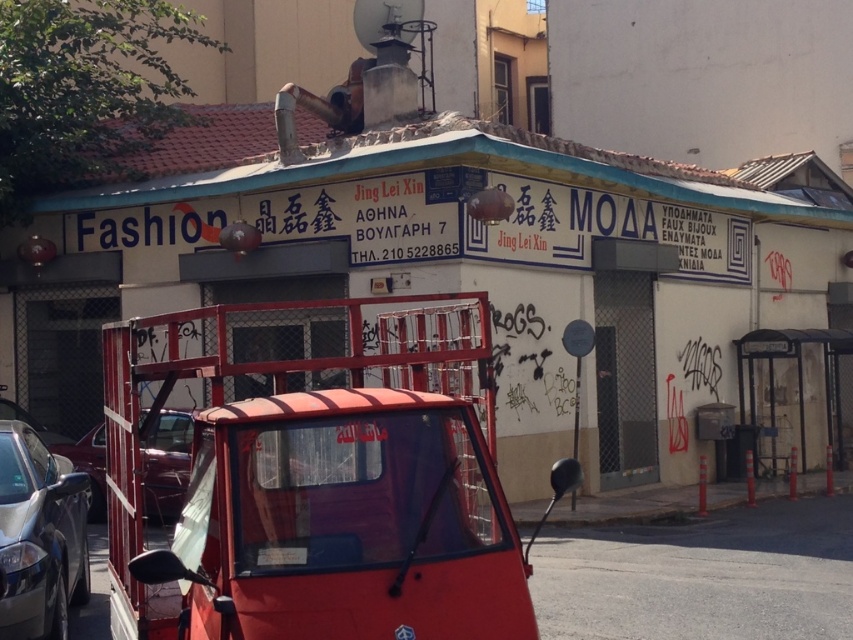
Is silver metallic car at lower left smaller than metallic red car at left?

No.

Which of these two, silver metallic car at lower left or metallic red car at left, stands taller?

silver metallic car at lower left is taller.

Which is behind, point (77, 490) or point (155, 436)?

The point (155, 436) is more distant.

At what (x,y) coordinates should I click in order to perform the action: click on silver metallic car at lower left. Please return your answer as a coordinate pair (x, y). This screenshot has height=640, width=853. Looking at the image, I should click on (39, 536).

Which is above, metallic red car at left or metallic red car at lower left?

metallic red car at lower left is higher up.

Is point (165, 483) positioned behind point (41, 429)?

No.

The height and width of the screenshot is (640, 853). In order to click on metallic red car at left in this screenshot , I will do `click(166, 464)`.

Which is more to the left, silver metallic car at lower left or white plastic license plate at center?

Positioned to the left is silver metallic car at lower left.

Does silver metallic car at lower left appear under white plastic license plate at center?

Correct, silver metallic car at lower left is located below white plastic license plate at center.

Is point (73, 564) farther from viewer compared to point (288, 556)?

Yes.

Find the location of `silver metallic car at lower left`. silver metallic car at lower left is located at coordinates (39, 536).